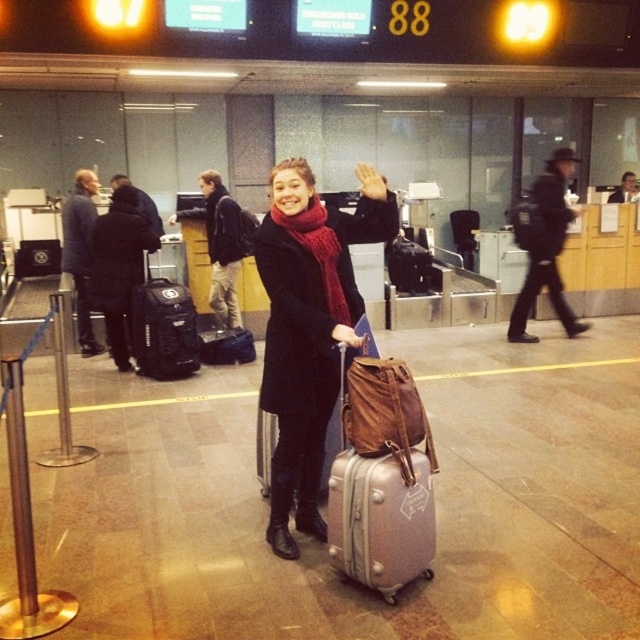
Question: Which of the following is the farthest from the observer?

Choices:
 (A) (77, 268)
 (B) (156, 289)
 (C) (113, 346)

Answer: (A)

Question: Does black leather backpack at center appear on the right side of black fabric backpack at left?

Choices:
 (A) yes
 (B) no

Answer: (A)

Question: Where is black leather backpack at center located in relation to dark blue backpack at center in the image?

Choices:
 (A) above
 (B) below

Answer: (A)

Question: Considering the real-world distances, which object is closest to the silver metallic suitcase at center?

Choices:
 (A) smooth black jacket at center
 (B) black fabric backpack at left
 (C) leather backpack at center

Answer: (C)

Question: Among these points, which one is farthest from the camera?

Choices:
 (A) (627, 173)
 (B) (316, 202)
 (C) (218, 189)

Answer: (A)

Question: Observing the image, what is the correct spatial positioning of leather backpack at center in reference to black fabric backpack at center-left?

Choices:
 (A) above
 (B) below

Answer: (B)